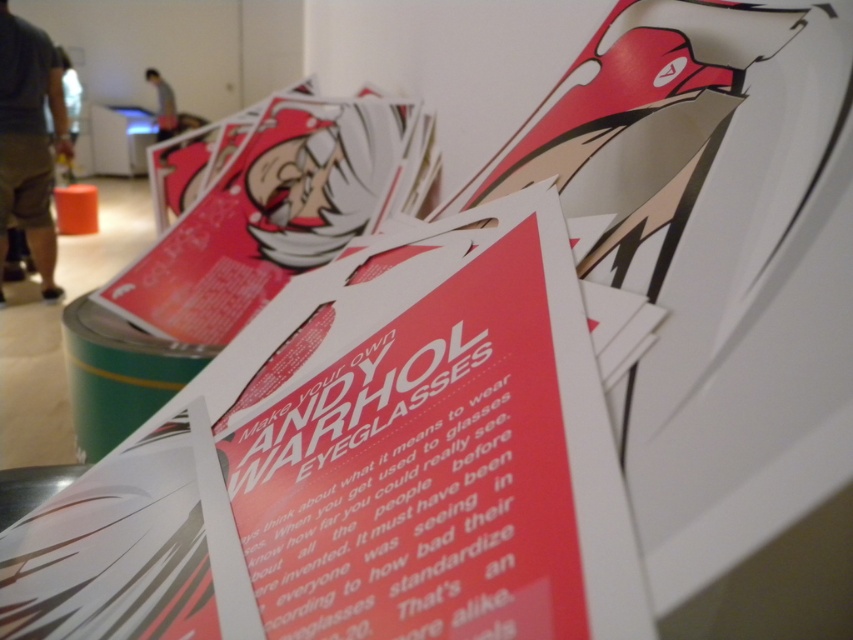
Question: Is matte paper poster at center further to camera compared to dark gray cotton shorts at left?

Choices:
 (A) yes
 (B) no

Answer: (B)

Question: Observing the image, what is the correct spatial positioning of dark gray cotton shorts at left in reference to blurred gray shirt at upper left?

Choices:
 (A) above
 (B) below

Answer: (B)

Question: Considering the real-world distances, which object is farthest from the dark gray cotton shorts at left?

Choices:
 (A) matte paper poster at center
 (B) blurred gray shirt at upper left

Answer: (A)

Question: Which of the following is the closest to the observer?

Choices:
 (A) matte paper poster at center
 (B) dark gray cotton shorts at left

Answer: (A)

Question: Estimate the real-world distances between objects in this image. Which object is closer to the blurred gray shirt at upper left?

Choices:
 (A) matte paper poster at center
 (B) dark gray cotton shorts at left

Answer: (B)

Question: Does matte paper poster at center have a smaller size compared to blurred gray shirt at upper left?

Choices:
 (A) yes
 (B) no

Answer: (B)